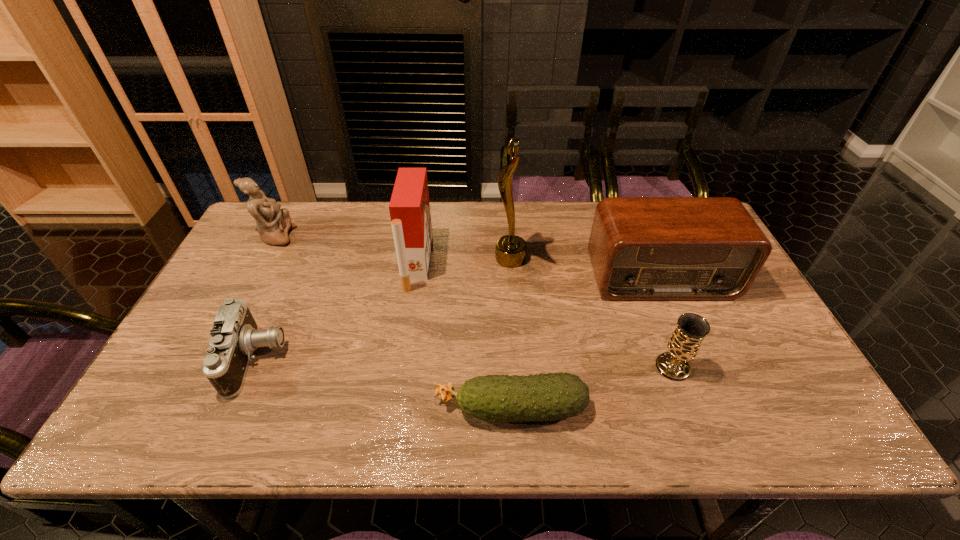
Where is `free region at the near right corner`? free region at the near right corner is located at coordinates (807, 413).

Where is `empty space between the award and the figurine`? This screenshot has height=540, width=960. empty space between the award and the figurine is located at coordinates (393, 247).

I want to click on free space between the figurine and the radio receiver, so click(x=468, y=256).

I want to click on blank region between the sixth tallest object and the award, so pyautogui.click(x=383, y=309).

Locate an element on the screen. Image resolution: width=960 pixels, height=540 pixels. empty space that is in between the chalice and the radio receiver is located at coordinates (666, 322).

Locate an element on the screen. The image size is (960, 540). free area in between the tallest object and the third shortest object is located at coordinates (591, 313).

Where is `free space between the figurine and the award`? This screenshot has width=960, height=540. free space between the figurine and the award is located at coordinates (393, 247).

Find the location of `unoccupied position between the figurine and the chalice`. unoccupied position between the figurine and the chalice is located at coordinates (474, 302).

Locate an element on the screen. Image resolution: width=960 pixels, height=540 pixels. free area in between the cigarette case and the third shortest object is located at coordinates (544, 315).

At what (x,y) coordinates should I click in order to perform the action: click on free space between the camera and the figurine. Please return your answer as a coordinate pair (x, y). Looking at the image, I should click on (265, 298).